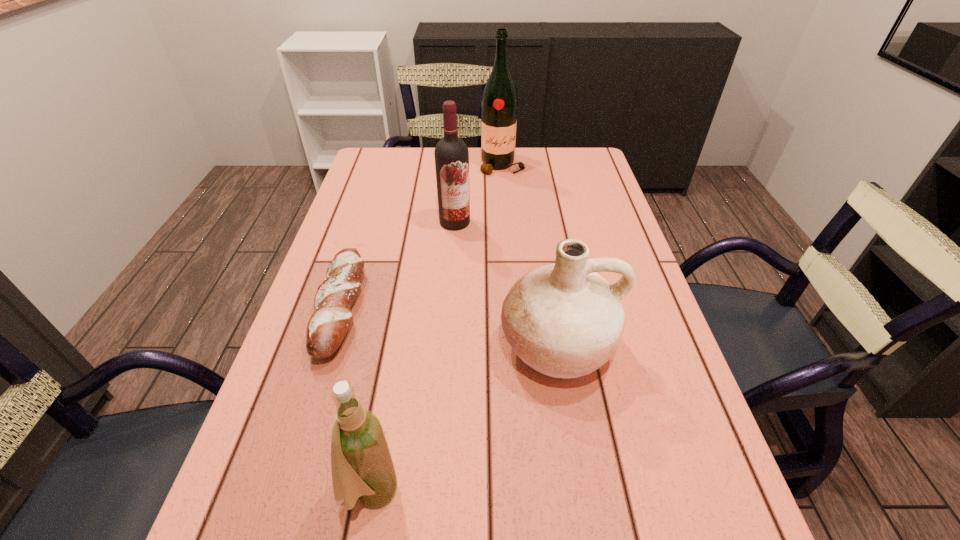
Locate an element on the screen. The width and height of the screenshot is (960, 540). the rightmost wine bottle is located at coordinates (499, 101).

Identify the location of the farthest object. The height and width of the screenshot is (540, 960). (499, 101).

Image resolution: width=960 pixels, height=540 pixels. What are the coordinates of `the second farthest wine bottle` in the screenshot? It's located at (451, 153).

Locate an element on the screen. Image resolution: width=960 pixels, height=540 pixels. the fourth nearest object is located at coordinates (451, 153).

Identify the location of the fourth object from right to left. This screenshot has width=960, height=540. (362, 467).

In order to click on the leftmost wine bottle in this screenshot , I will do `click(362, 467)`.

Image resolution: width=960 pixels, height=540 pixels. Find the location of `pottery`. pottery is located at coordinates (564, 320).

This screenshot has height=540, width=960. I want to click on baguet, so click(327, 327).

At what (x,y) coordinates should I click in order to perform the action: click on the leftmost object. Please return your answer as a coordinate pair (x, y). Looking at the image, I should click on (327, 327).

Where is `vacant position located 0.200m on the left of the rightmost wine bottle`? The width and height of the screenshot is (960, 540). vacant position located 0.200m on the left of the rightmost wine bottle is located at coordinates (420, 166).